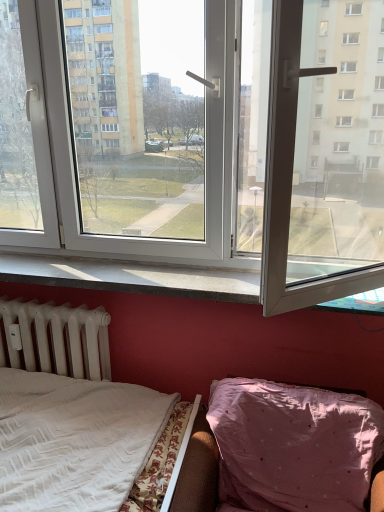
Question: Considering the positions of pink fabric hospital bed at lower right and white plastic window at center in the image, is pink fabric hospital bed at lower right taller or shorter than white plastic window at center?

Choices:
 (A) tall
 (B) short

Answer: (B)

Question: From the image's perspective, is pink fabric hospital bed at lower right located above or below white plastic window at center?

Choices:
 (A) above
 (B) below

Answer: (B)

Question: Which object is positioned farthest from the white textured bed at lower left?

Choices:
 (A) white plastic window at center
 (B) white matte radiator at lower left
 (C) white glossy window sill at lower center
 (D) pink fabric hospital bed at lower right

Answer: (A)

Question: Which object is positioned closest to the white plastic window at center?

Choices:
 (A) white matte radiator at lower left
 (B) white glossy window sill at lower center
 (C) white textured bed at lower left
 (D) pink fabric hospital bed at lower right

Answer: (B)